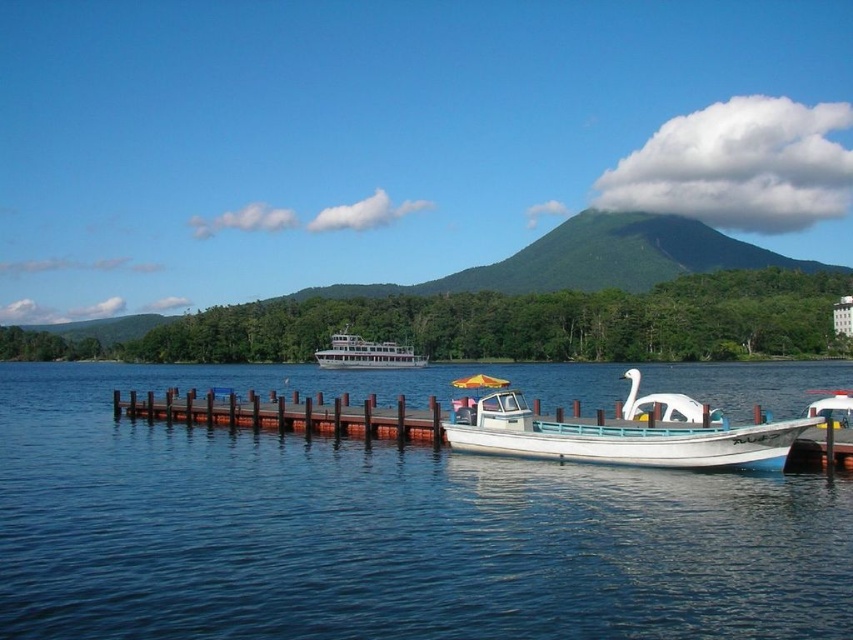
Who is positioned more to the right, blue water at dock center or white glossy ferry at center?

From the viewer's perspective, blue water at dock center appears more on the right side.

Looking at this image, does blue water at dock center have a greater height compared to white glossy ferry at center?

In fact, blue water at dock center may be shorter than white glossy ferry at center.

Is point (56, 545) behind point (393, 356)?

No, (56, 545) is closer to viewer.

Where is `blue water at dock center`? blue water at dock center is located at coordinates (386, 525).

Is blue water at dock center thinner than brown wooden dock at lower center?

In fact, blue water at dock center might be wider than brown wooden dock at lower center.

Between point (311, 484) and point (297, 410), which one is positioned behind?

Point (297, 410)

Is point (97, 412) positioned after point (202, 417)?

Yes.

Locate an element on the screen. blue water at dock center is located at coordinates (386, 525).

From the picture: Is white matte boat at center taller than white glossy ferry at center?

No.

Can you confirm if white matte boat at center is thinner than white glossy ferry at center?

No, white matte boat at center is not thinner than white glossy ferry at center.

Which is behind, point (633, 452) or point (347, 346)?

Positioned behind is point (347, 346).

Image resolution: width=853 pixels, height=640 pixels. In order to click on white matte boat at center in this screenshot , I will do `click(619, 432)`.